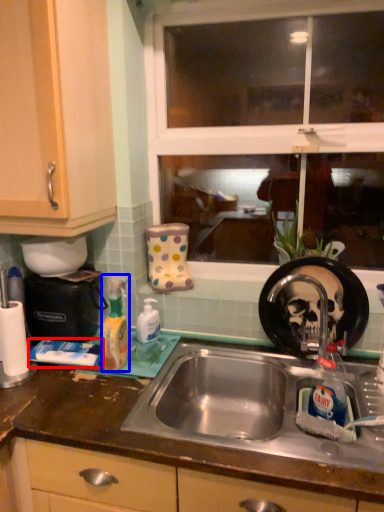
Question: Among these objects, which one is farthest to the camera, toothpaste (highlighted by a red box) or cleaning product (highlighted by a blue box)?

Choices:
 (A) toothpaste
 (B) cleaning product

Answer: (A)